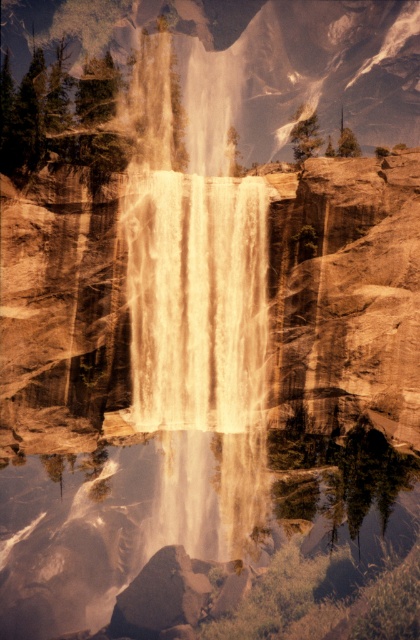
Question: Observing the image, what is the correct spatial positioning of translucent water at center in reference to white frothy water at center?

Choices:
 (A) below
 (B) above

Answer: (A)

Question: Among these objects, which one is farthest from the camera?

Choices:
 (A) translucent water at center
 (B) white frothy water at center

Answer: (B)

Question: Which of the following is the closest to the observer?

Choices:
 (A) (99, 522)
 (B) (199, 312)

Answer: (B)

Question: Is translucent water at center further to camera compared to white frothy water at center?

Choices:
 (A) yes
 (B) no

Answer: (B)

Question: Does translucent water at center have a lesser width compared to white frothy water at center?

Choices:
 (A) yes
 (B) no

Answer: (B)